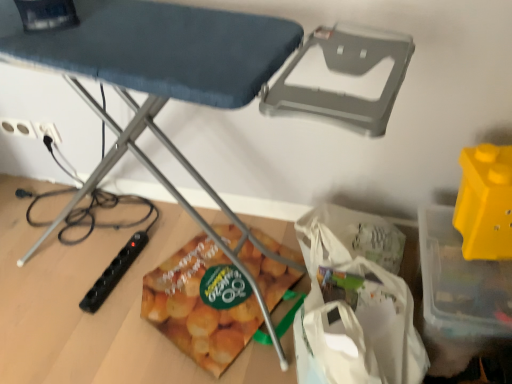
Describe the element at coordinates (48, 131) in the screenshot. I see `white plastic electric outlet at lower left, acting as the 2th electric outlet starting from the left` at that location.

This screenshot has width=512, height=384. What do you see at coordinates (17, 127) in the screenshot?
I see `white plastic electric outlet at upper left, which is counted as the 1th electric outlet, starting from the left` at bounding box center [17, 127].

Image resolution: width=512 pixels, height=384 pixels. Identify the location of yellow plastic toy at upper right, which ranks as the second toy in back-to-front order. [485, 202].

Is yellow plastic storage box at right wider or thinner than white plastic electric outlet at lower left, acting as the 2th electric outlet starting from the left?

Clearly, yellow plastic storage box at right has more width compared to white plastic electric outlet at lower left, acting as the 2th electric outlet starting from the left.

Consider the image. Are yellow plastic storage box at right and white plastic electric outlet at lower left, which appears as the first electric outlet when viewed from the right, making contact?

They are not placed beside each other.

Which object is closer to the camera, yellow plastic storage box at right or white plastic electric outlet at lower left, which appears as the first electric outlet when viewed from the right?

yellow plastic storage box at right.

Does black plastic power strip at lower left, marked as the first toy in a left-to-right arrangement, have a lesser width compared to yellow plastic toy at upper right, the 2th toy in the bottom-to-top sequence?

Incorrect, the width of black plastic power strip at lower left, marked as the first toy in a left-to-right arrangement, is not less than that of yellow plastic toy at upper right, the 2th toy in the bottom-to-top sequence.

Does black plastic power strip at lower left, placed as the second toy when sorted from right to left, turn towards yellow plastic toy at upper right, the 2th toy in the bottom-to-top sequence?

No, black plastic power strip at lower left, placed as the second toy when sorted from right to left, is not turned towards yellow plastic toy at upper right, the 2th toy in the bottom-to-top sequence.

Is black plastic power strip at lower left, marked as the 1th toy in a bottom-to-top arrangement, at the left side of yellow plastic toy at upper right, which ranks as the second toy in back-to-front order?

Correct, you'll find black plastic power strip at lower left, marked as the 1th toy in a bottom-to-top arrangement, to the left of yellow plastic toy at upper right, which ranks as the second toy in back-to-front order.

From a real-world perspective, is black plastic power strip at lower left, marked as the first toy in a left-to-right arrangement, physically below yellow plastic toy at upper right, marked as the 1th toy in a right-to-left arrangement?

Correct, in the physical world, black plastic power strip at lower left, marked as the first toy in a left-to-right arrangement, is lower than yellow plastic toy at upper right, marked as the 1th toy in a right-to-left arrangement.

Is white plastic electric outlet at lower left, which appears as the first electric outlet when viewed from the right, further to the viewer compared to white plastic electric outlet at upper left, which is counted as the 1th electric outlet, starting from the left?

No, it is in front of white plastic electric outlet at upper left, which is counted as the 1th electric outlet, starting from the left.

Does point (59, 141) appear closer or farther from the camera than point (17, 126)?

Point (59, 141).

Considering the sizes of objects white plastic electric outlet at lower left, which appears as the first electric outlet when viewed from the right, and white plastic electric outlet at upper left, which is counted as the 1th electric outlet, starting from the left, in the image provided, who is wider, white plastic electric outlet at lower left, which appears as the first electric outlet when viewed from the right, or white plastic electric outlet at upper left, which is counted as the 1th electric outlet, starting from the left,?

white plastic electric outlet at lower left, which appears as the first electric outlet when viewed from the right, is wider.

Identify the location of electric outlet that appears below the white plastic electric outlet at upper left, which is counted as the 1th electric outlet, starting from the left (from the image's perspective). (48, 131).

Is white fabric grocery bag at lower center positioned before white plastic electric outlet at lower left, acting as the 2th electric outlet starting from the left?

Yes, it is.

Considering the sizes of white fabric grocery bag at lower center and white plastic electric outlet at lower left, acting as the 2th electric outlet starting from the left, in the image, is white fabric grocery bag at lower center wider or thinner than white plastic electric outlet at lower left, acting as the 2th electric outlet starting from the left,?

Clearly, white fabric grocery bag at lower center has more width compared to white plastic electric outlet at lower left, acting as the 2th electric outlet starting from the left.

Is white fabric grocery bag at lower center oriented towards white plastic electric outlet at lower left, which appears as the first electric outlet when viewed from the right?

Yes, white fabric grocery bag at lower center is oriented towards white plastic electric outlet at lower left, which appears as the first electric outlet when viewed from the right.

Locate an element on the screen. The height and width of the screenshot is (384, 512). grocery bag below the white plastic electric outlet at lower left, acting as the 2th electric outlet starting from the left (from the image's perspective) is located at coordinates (355, 302).

Is matte plastic snack bag at lower center to the left of yellow plastic storage box at right from the viewer's perspective?

Yes, matte plastic snack bag at lower center is to the left of yellow plastic storage box at right.

Would you consider matte plastic snack bag at lower center to be distant from yellow plastic storage box at right?

No, matte plastic snack bag at lower center is not far from yellow plastic storage box at right.

How many degrees apart are the facing directions of matte plastic snack bag at lower center and yellow plastic storage box at right?

There is a 159-degree angle between the facing directions of matte plastic snack bag at lower center and yellow plastic storage box at right.

Considering the relative sizes of white plastic electric outlet at upper left, which is counted as the 1th electric outlet, starting from the left, and yellow plastic toy at upper right, marked as the 1th toy in a right-to-left arrangement, in the image provided, is white plastic electric outlet at upper left, which is counted as the 1th electric outlet, starting from the left, smaller than yellow plastic toy at upper right, marked as the 1th toy in a right-to-left arrangement,?

Yes.

Could you tell me if white plastic electric outlet at upper left, positioned as the 2th electric outlet in right-to-left order, is turned towards yellow plastic toy at upper right, the 1th toy in the front-to-back sequence?

No, white plastic electric outlet at upper left, positioned as the 2th electric outlet in right-to-left order, is not facing towards yellow plastic toy at upper right, the 1th toy in the front-to-back sequence.

From a real-world perspective, is white plastic electric outlet at upper left, positioned as the 2th electric outlet in right-to-left order, physically above yellow plastic toy at upper right, acting as the 2th toy starting from the left?

No, from a real-world perspective, white plastic electric outlet at upper left, positioned as the 2th electric outlet in right-to-left order, is not on top of yellow plastic toy at upper right, acting as the 2th toy starting from the left.

Is there a large distance between yellow plastic storage box at right and metallic ironing board at center?

No, yellow plastic storage box at right is not far from metallic ironing board at center.

Is point (444, 272) more distant than point (151, 37)?

Yes, it is.

Is yellow plastic storage box at right in front of metallic ironing board at center?

No.

Which of these two, yellow plastic storage box at right or metallic ironing board at center, is smaller?

Smaller between the two is yellow plastic storage box at right.

Find the location of `storage box below the white plastic electric outlet at lower left, acting as the 2th electric outlet starting from the left (from a real-world perspective)`. storage box below the white plastic electric outlet at lower left, acting as the 2th electric outlet starting from the left (from a real-world perspective) is located at coordinates (461, 282).

At what (x,y) coordinates should I click in order to perform the action: click on toy that appears above the black plastic power strip at lower left, marked as the first toy in a left-to-right arrangement (from the image's perspective). Please return your answer as a coordinate pair (x, y). This screenshot has width=512, height=384. Looking at the image, I should click on (485, 202).

Considering their positions, is metallic ironing board at center positioned further to yellow plastic storage box at right than black plastic power strip at lower left, placed as the second toy when sorted from right to left?

The object further to yellow plastic storage box at right is black plastic power strip at lower left, placed as the second toy when sorted from right to left.

When comparing their distances from black plastic power strip at lower left, which appears as the second toy when viewed from the front, does white plastic electric outlet at upper left, positioned as the 2th electric outlet in right-to-left order, or white fabric grocery bag at lower center seem further?

The object further to black plastic power strip at lower left, which appears as the second toy when viewed from the front, is white fabric grocery bag at lower center.

Considering their positions, is white fabric grocery bag at lower center positioned further to yellow plastic storage box at right than matte plastic snack bag at lower center?

Among the two, matte plastic snack bag at lower center is located further to yellow plastic storage box at right.

When comparing their distances from metallic ironing board at center, does yellow plastic toy at upper right, the 2th toy in the bottom-to-top sequence, or white plastic electric outlet at upper left, positioned as the 2th electric outlet in right-to-left order, seem closer?

The object closer to metallic ironing board at center is yellow plastic toy at upper right, the 2th toy in the bottom-to-top sequence.

When comparing their distances from metallic ironing board at center, does yellow plastic toy at upper right, the 1th toy in the front-to-back sequence, or matte plastic snack bag at lower center seem further?

yellow plastic toy at upper right, the 1th toy in the front-to-back sequence, lies further to metallic ironing board at center than the other object.

Considering their positions, is white plastic electric outlet at upper left, which is counted as the 1th electric outlet, starting from the left, positioned further to yellow plastic storage box at right than black plastic power strip at lower left, marked as the first toy in a left-to-right arrangement?

Among the two, white plastic electric outlet at upper left, which is counted as the 1th electric outlet, starting from the left, is located further to yellow plastic storage box at right.

Estimate the real-world distances between objects in this image. Which object is further from white fabric grocery bag at lower center, yellow plastic storage box at right or black plastic power strip at lower left, which appears as the second toy when viewed from the front?

black plastic power strip at lower left, which appears as the second toy when viewed from the front, is positioned further to the anchor white fabric grocery bag at lower center.

When comparing their distances from yellow plastic storage box at right, does matte plastic snack bag at lower center or yellow plastic toy at upper right, the 1th toy in the front-to-back sequence, seem closer?

A: The object closer to yellow plastic storage box at right is yellow plastic toy at upper right, the 1th toy in the front-to-back sequence.

The width and height of the screenshot is (512, 384). Find the location of `toy between metallic ironing board at center and yellow plastic storage box at right from left to right`. toy between metallic ironing board at center and yellow plastic storage box at right from left to right is located at coordinates (485, 202).

The image size is (512, 384). What are the coordinates of `toy between white plastic electric outlet at upper left, which is counted as the 1th electric outlet, starting from the left, and yellow plastic toy at upper right, marked as the 1th toy in a right-to-left arrangement, in the horizontal direction` in the screenshot? It's located at (114, 272).

Where is `electric outlet between white plastic electric outlet at upper left, positioned as the 2th electric outlet in right-to-left order, and matte plastic snack bag at lower center, in the horizontal direction`? electric outlet between white plastic electric outlet at upper left, positioned as the 2th electric outlet in right-to-left order, and matte plastic snack bag at lower center, in the horizontal direction is located at coordinates tap(48, 131).

I want to click on grocery bag between white plastic electric outlet at lower left, which appears as the first electric outlet when viewed from the right, and yellow plastic storage box at right, so click(355, 302).